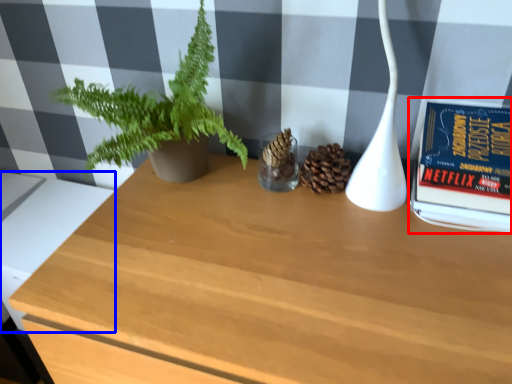
Question: Which object appears farthest to the camera in this image, paperback book (highlighted by a red box) or table (highlighted by a blue box)?

Choices:
 (A) paperback book
 (B) table

Answer: (B)